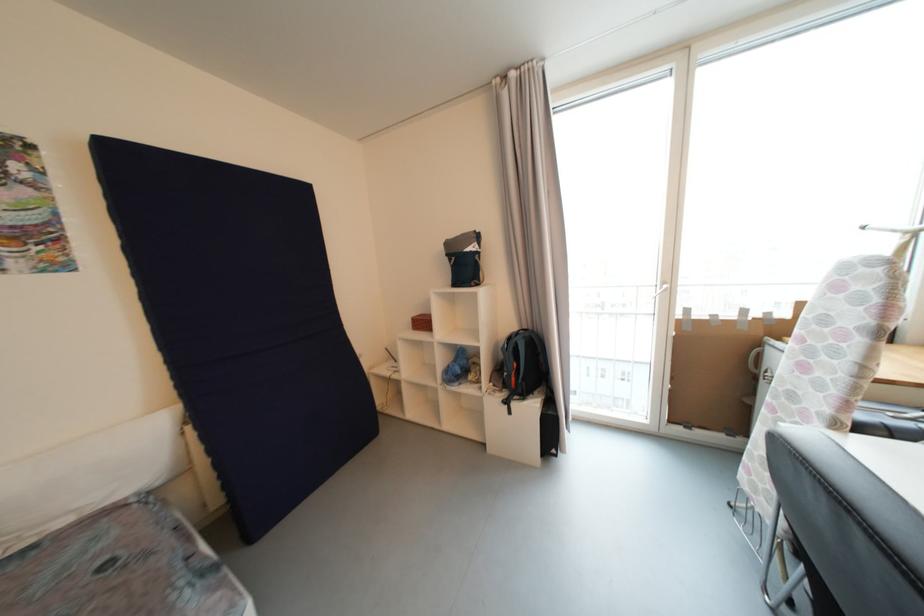
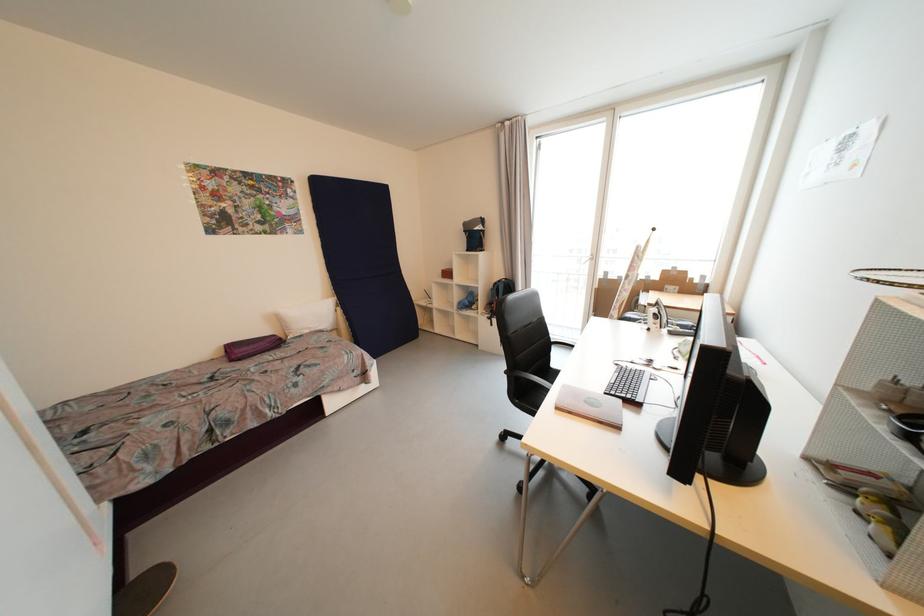
In the second image, find the point that corresponds to point 195,431 in the first image.

(344, 310)